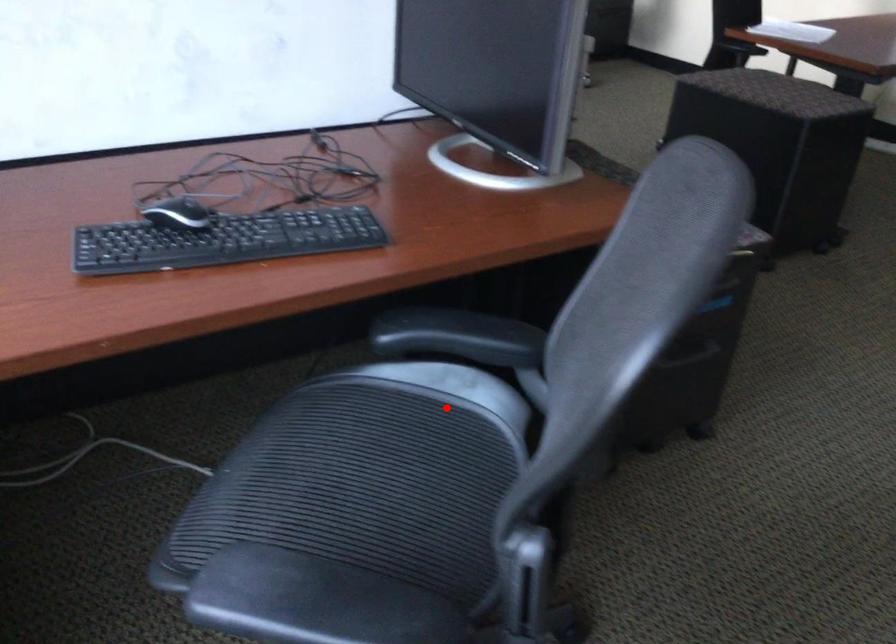
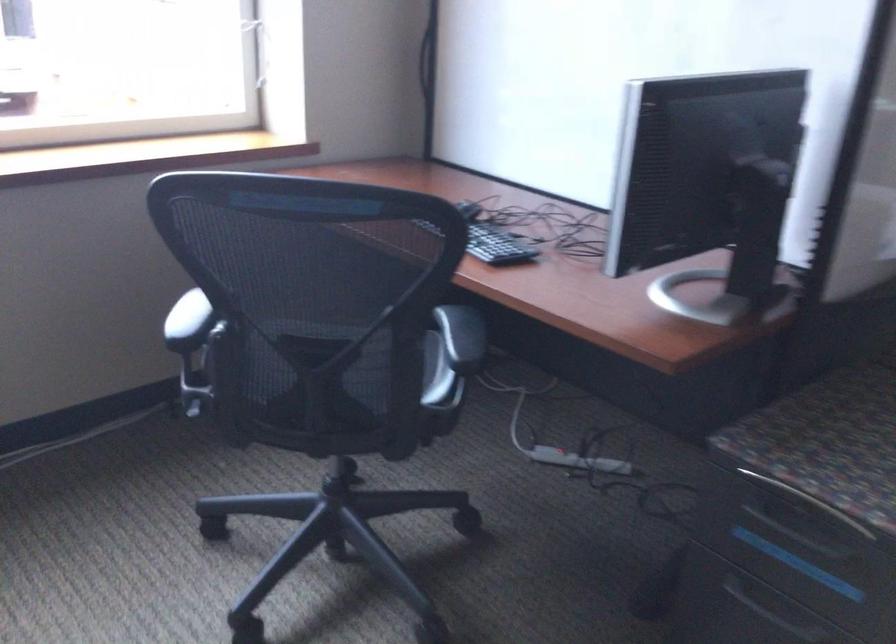
The point at the highlighted location is marked in the first image. Where is the corresponding point in the second image?

(435, 373)